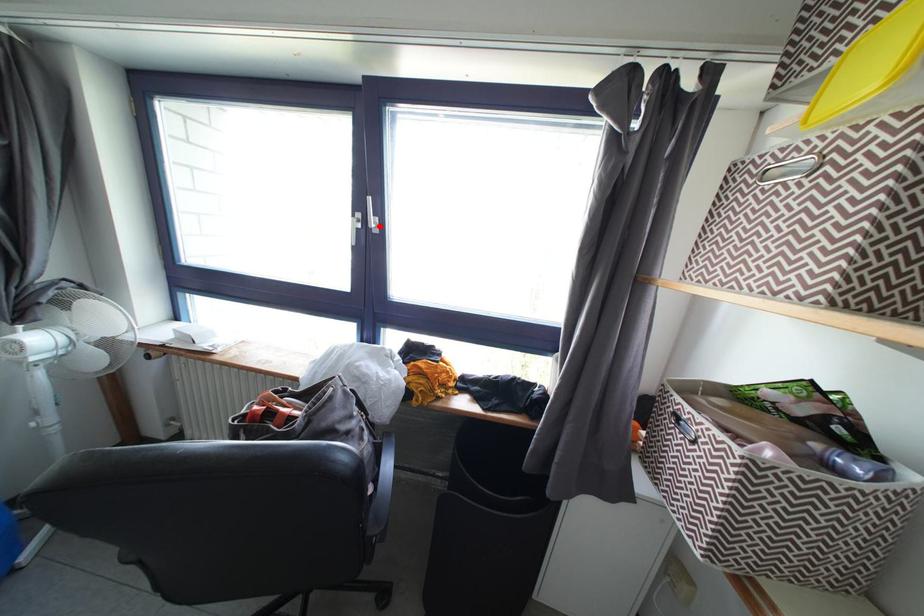
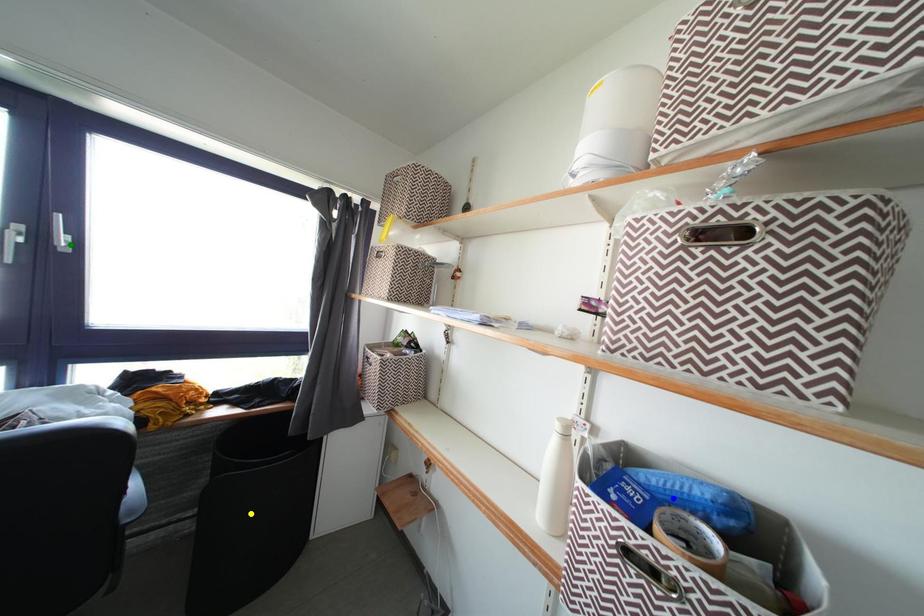
Question: I am providing you with two images of the same scene from different viewpoints. A red point is marked on the first image. You are given multiple points on the second image. In image 2, which mark is for the same physical point as the one in image 1?

Choices:
 (A) blue point
 (B) green point
 (C) yellow point

Answer: (B)